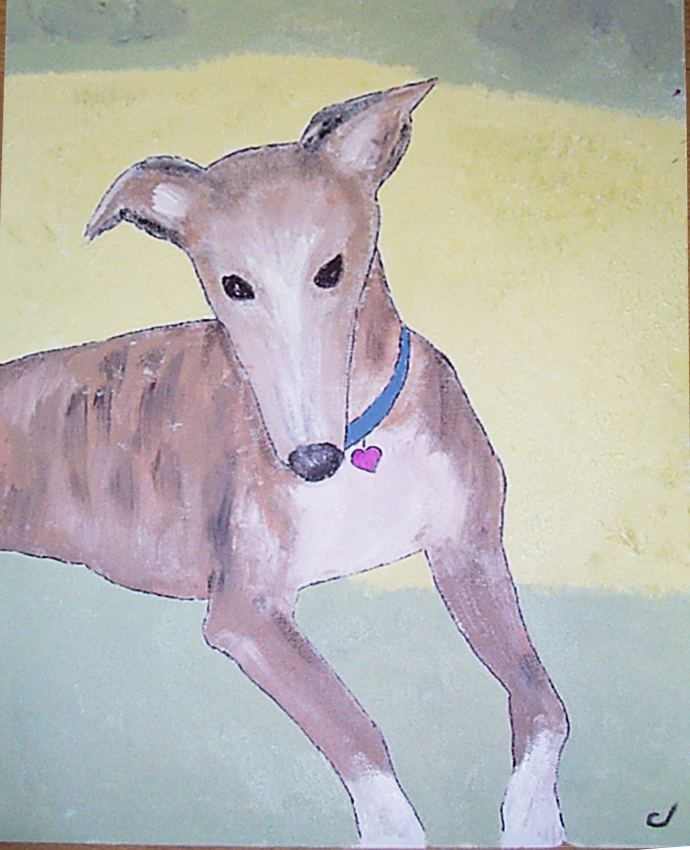
You are a GUI agent. You are given a task and a screenshot of the screen. Output one action in this format:
    pyautogui.click(x=<x>, y=<y>)
    Task: Click on the light teal colored background floor
    This screenshot has height=850, width=690.
    Given the screenshot: What is the action you would take?
    point(197,758)